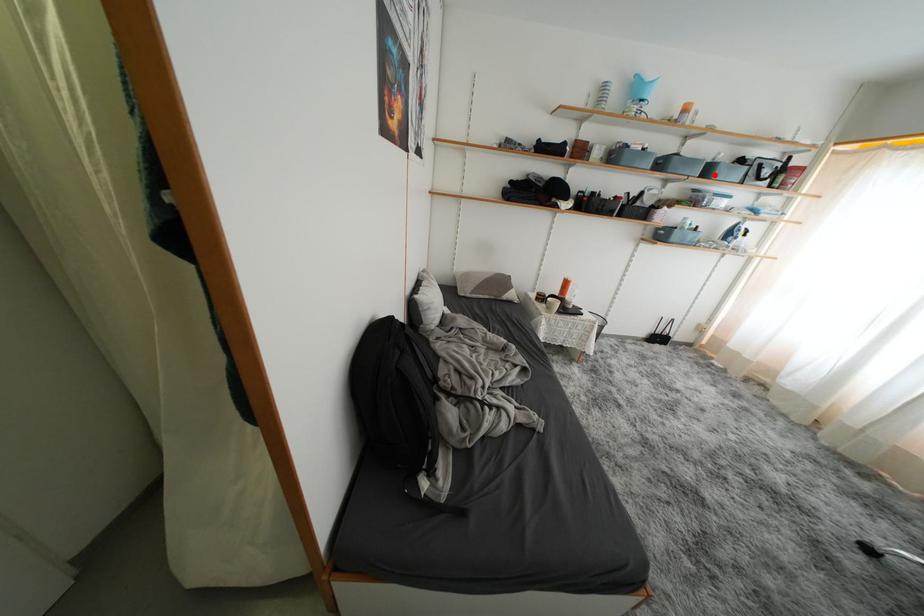
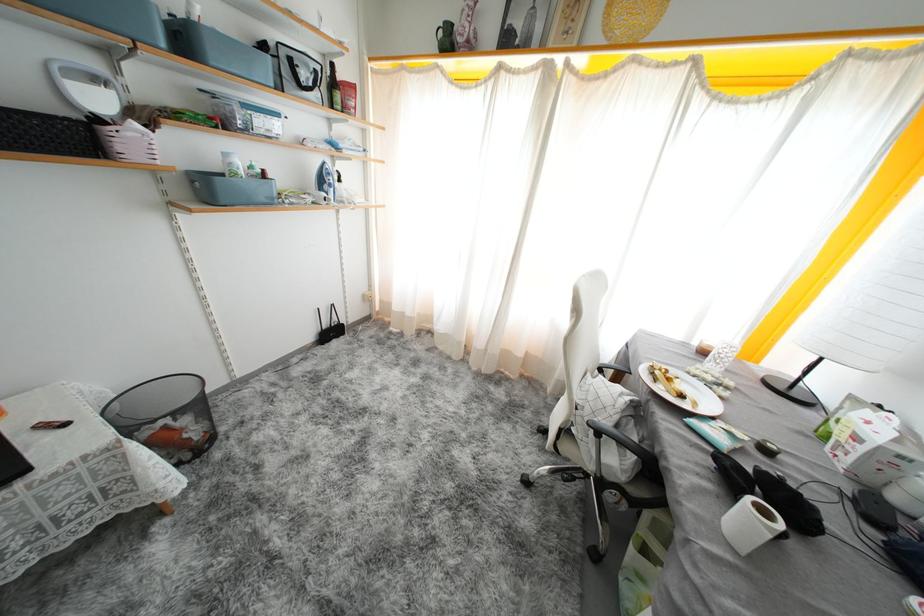
Question: A red point is marked in image1. In image2, is the corresponding 3D point closer to the camera or farther? Reply with the corresponding letter.

Choices:
 (A) The corresponding 3D point is closer.
 (B) The corresponding 3D point is farther.

Answer: (B)